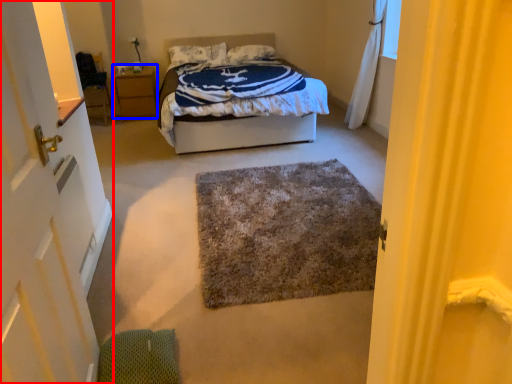
Question: Which of the following is the closest to the observer, door (highlighted by a red box) or nightstand (highlighted by a blue box)?

Choices:
 (A) door
 (B) nightstand

Answer: (A)